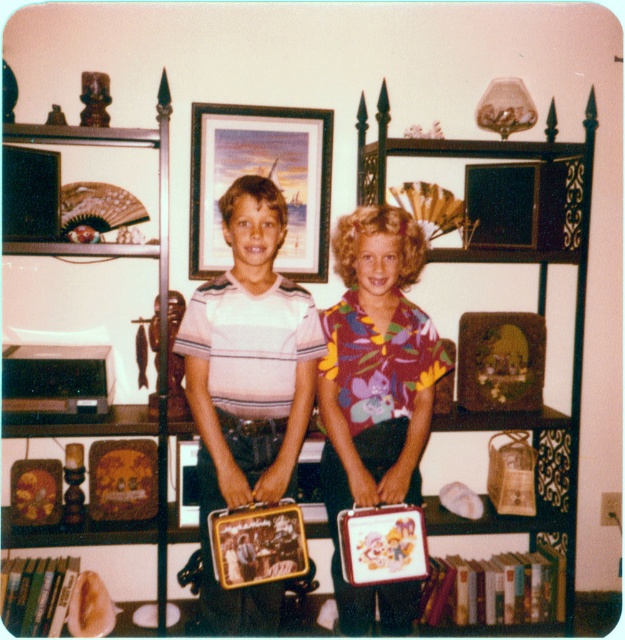
You are a parent trying to place a new plant pot on the highest shelf in the room. You see the wooden bookshelf at center and the wooden shelf at upper left. Which one should you choose?

The wooden bookshelf at center is located above the wooden shelf at upper left, so you should choose the wooden bookshelf at center to place the new plant pot as it is higher.

You are trying to hang a new decoration between the wooden picture frame at center and the wooden bookshelf at center. Can you place it in between them?

The wooden picture frame at center is located above the wooden bookshelf at center, so there is no space between them for a new decoration to be placed in between.